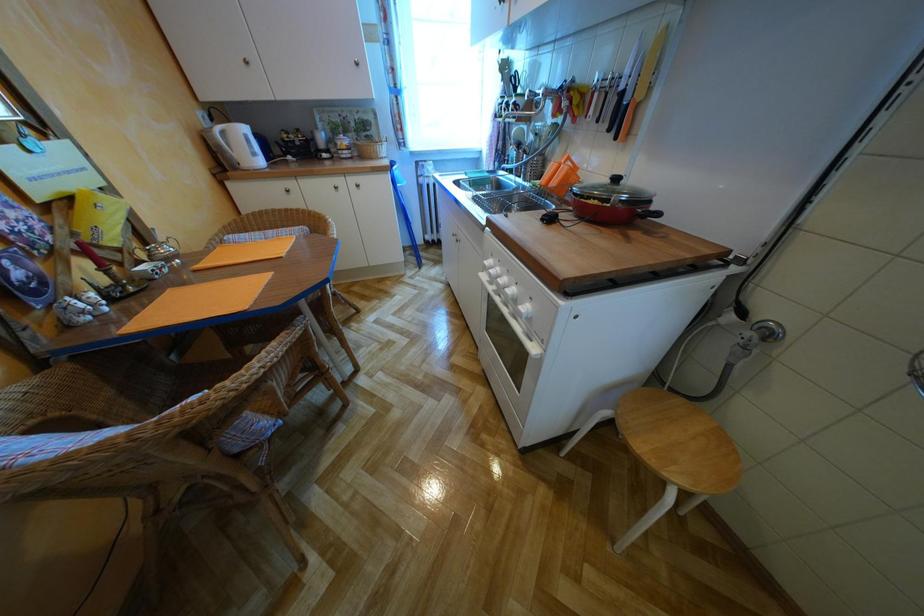
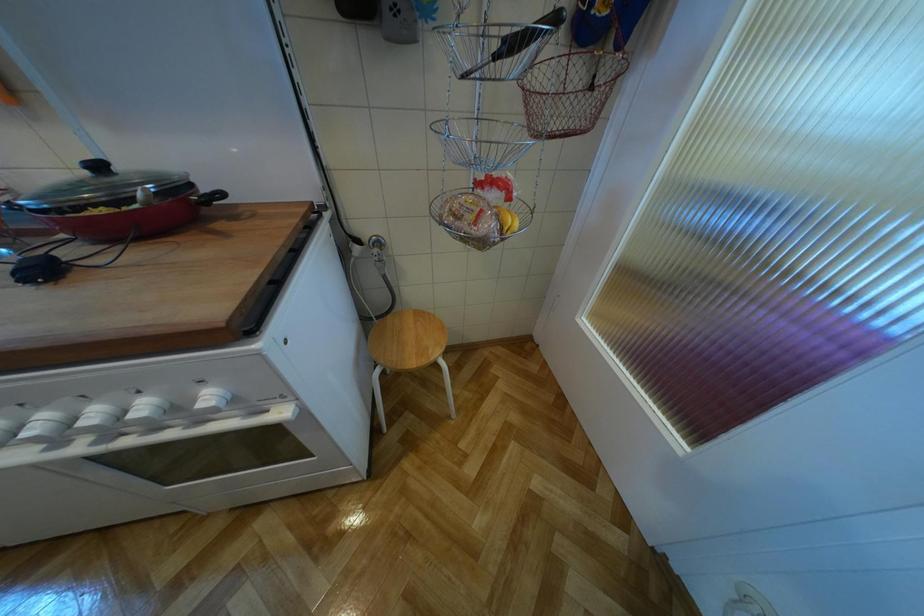
The images are taken continuously from a first-person perspective. In which direction is your viewpoint rotating?

The camera's rotation is toward right-down.